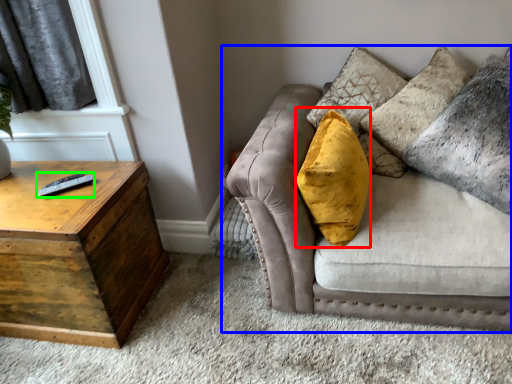
Question: Based on their relative distances, which object is nearer to throw pillow (highlighted by a red box)? Choose from studio couch (highlighted by a blue box) and remote (highlighted by a green box).

Choices:
 (A) studio couch
 (B) remote

Answer: (A)